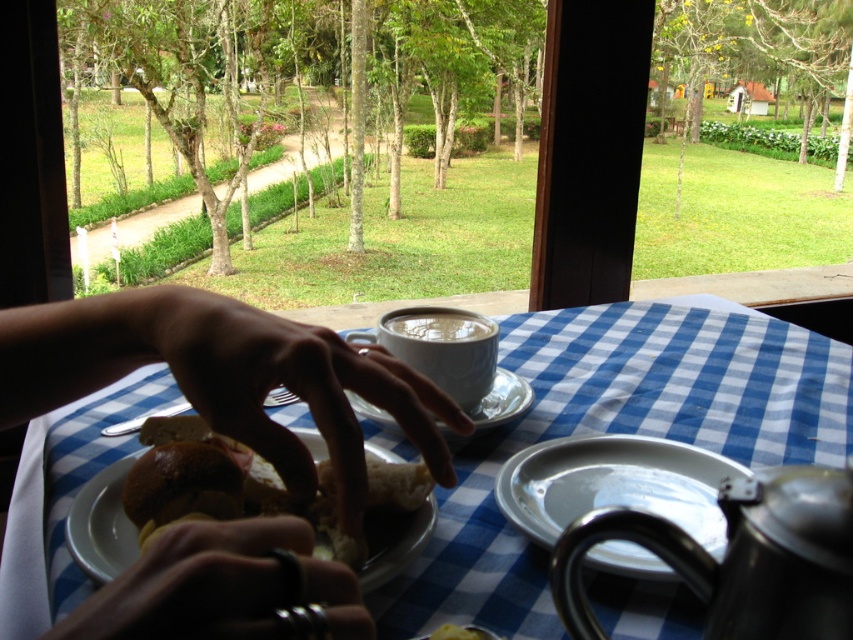
Question: Can you confirm if white glossy plate at center is positioned to the left of white ceramic plate at center?

Choices:
 (A) no
 (B) yes

Answer: (A)

Question: Which object is the closest to the metallic ring at lower center?

Choices:
 (A) white glossy plate at center
 (B) blue checkered tablecloth at center
 (C) white glossy cup at center
 (D) white ceramic plate at center

Answer: (D)

Question: Is white glossy cup at center thinner than white ceramic cup at center?

Choices:
 (A) no
 (B) yes

Answer: (B)

Question: Can you confirm if white glossy plate at center is wider than white ceramic plate at center?

Choices:
 (A) no
 (B) yes

Answer: (A)

Question: Estimate the real-world distances between objects in this image. Which object is closer to the metallic ring at lower center?

Choices:
 (A) matte ceramic cup at center
 (B) matte skin hand at center
 (C) white glossy cup at center
 (D) blue checkered tablecloth at center

Answer: (B)

Question: Which point is closer to the camera?

Choices:
 (A) matte ceramic cup at center
 (B) white glossy cup at center
 (C) metallic ring at lower center

Answer: (C)